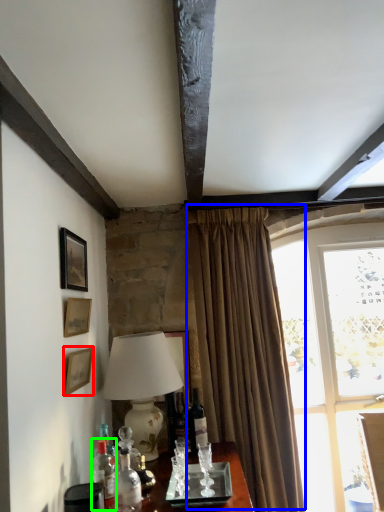
Question: Considering the real-world distances, which object is closest to picture frame (highlighted by a red box)? curtain (highlighted by a blue box) or bottle (highlighted by a green box).

Choices:
 (A) curtain
 (B) bottle

Answer: (B)